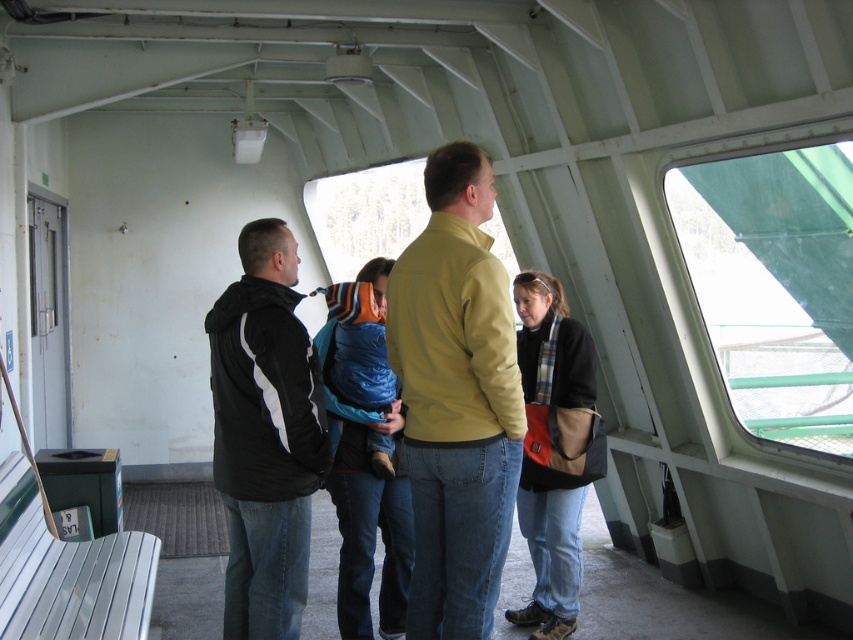
Question: Does matte yellow sweater at center appear on the right side of black soft fabric jacket at lower right?

Choices:
 (A) no
 (B) yes

Answer: (A)

Question: Which point is farther to the camera?

Choices:
 (A) [799, 148]
 (B) [277, 593]

Answer: (A)

Question: Estimate the real-world distances between objects in this image. Which object is closer to the matte yellow jacket at center?

Choices:
 (A) black soft fabric jacket at lower right
 (B) transparent plastic window at right
 (C) matte yellow sweater at center
 (D) black matte jacket at left

Answer: (C)

Question: Is matte yellow jacket at center thinner than matte yellow sweater at center?

Choices:
 (A) no
 (B) yes

Answer: (B)

Question: Can you confirm if black matte jacket at left is positioned below black soft fabric jacket at lower right?

Choices:
 (A) yes
 (B) no

Answer: (B)

Question: Which object is closer to the camera taking this photo?

Choices:
 (A) matte yellow jacket at center
 (B) black soft fabric jacket at lower right

Answer: (A)